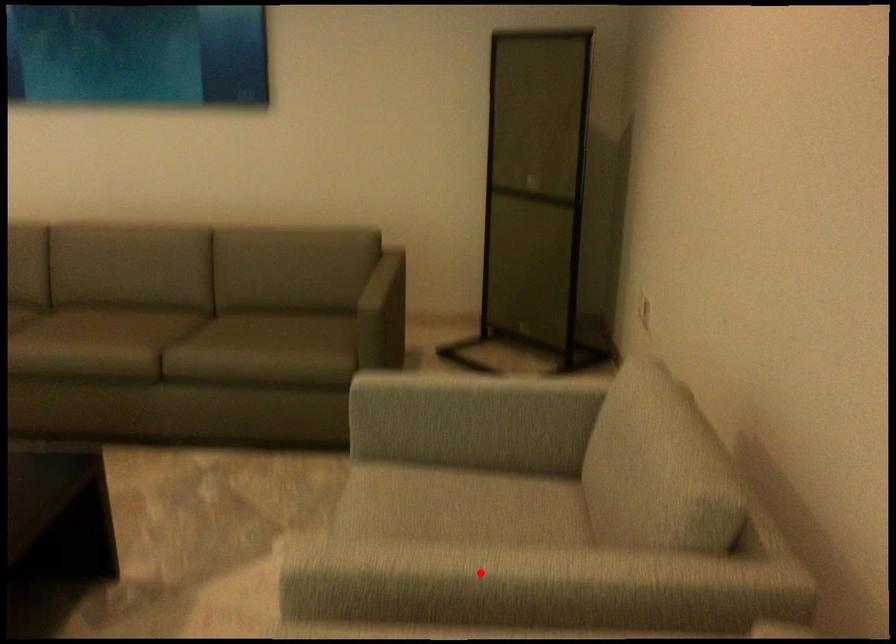
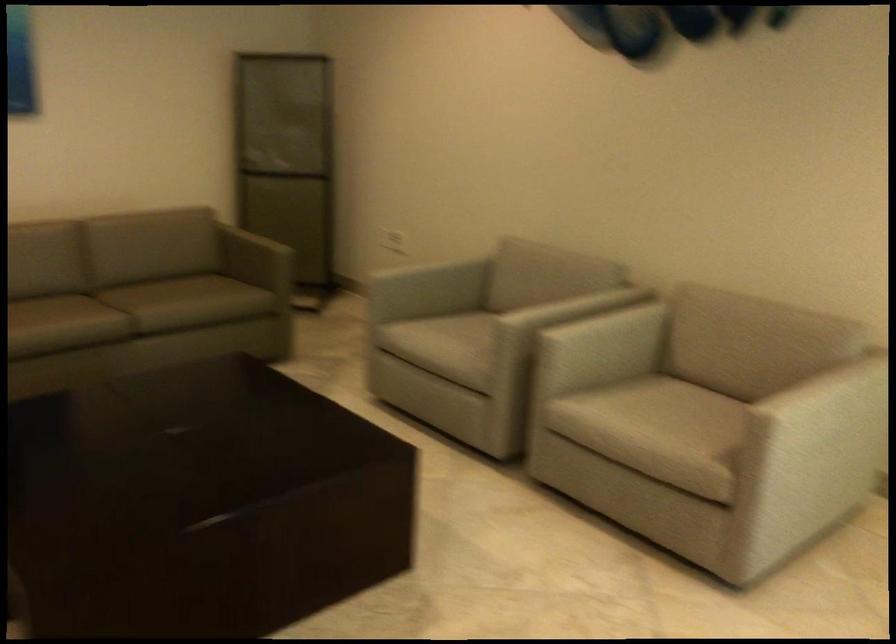
Question: I am providing you with two images of the same scene from different viewpoints. A red point is marked on the first image. At the location where the point appears in image 1, is it still visible in image 2?

Choices:
 (A) Yes
 (B) No

Answer: (A)